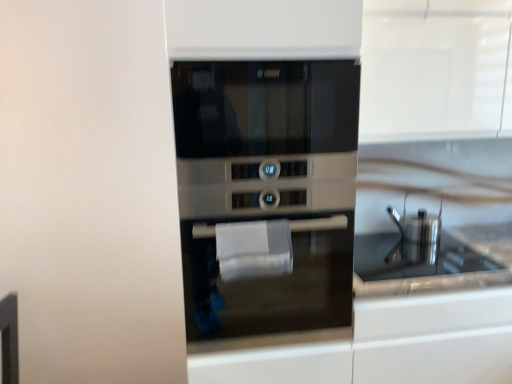
Question: Is glossy stainless steel sink at center inside or outside of satin silver oven at center?

Choices:
 (A) inside
 (B) outside

Answer: (B)

Question: Looking at the image, does glossy stainless steel sink at center seem bigger or smaller compared to satin silver oven at center?

Choices:
 (A) big
 (B) small

Answer: (B)

Question: Which of these objects is positioned closest to the white textured hand towel at center?

Choices:
 (A) satin silver oven at center
 (B) satin silver oven at center
 (C) glossy stainless steel sink at center

Answer: (B)

Question: Based on their relative distances, which object is nearer to the glossy stainless steel sink at center?

Choices:
 (A) satin silver oven at center
 (B) white textured hand towel at center
 (C) satin silver oven at center

Answer: (A)